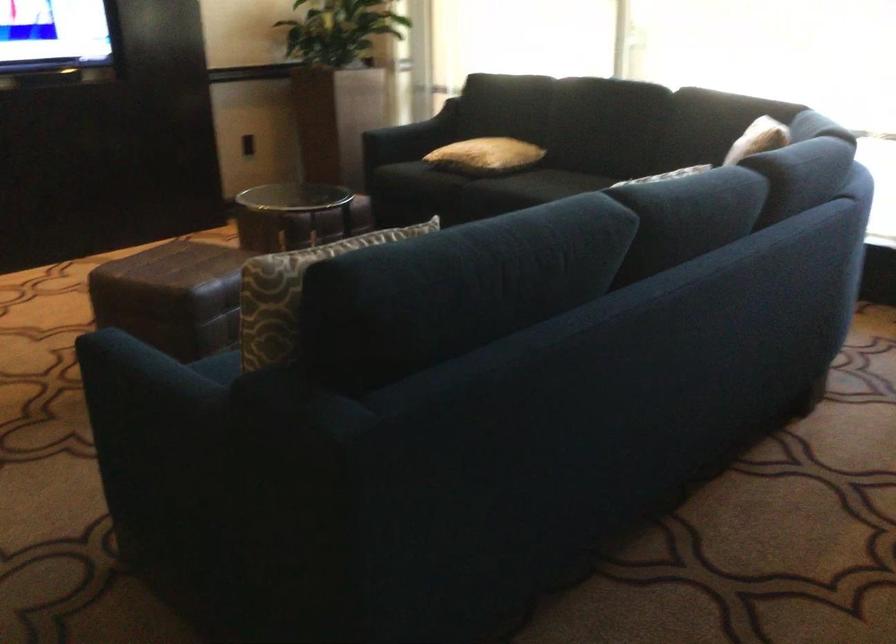
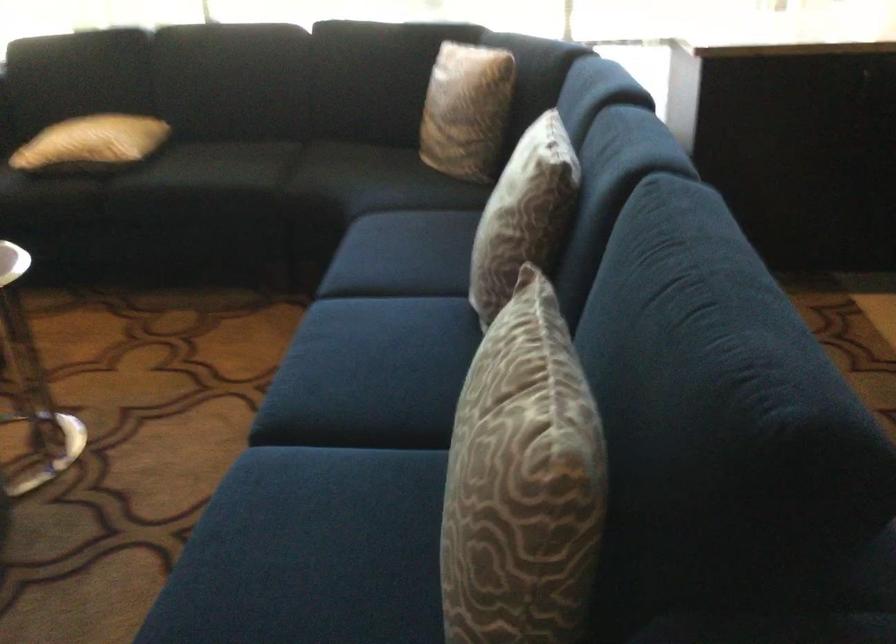
In the second image, find the point that corresponds to [474,151] in the first image.

(91, 142)